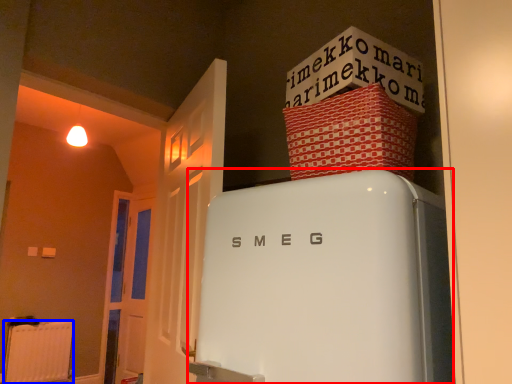
Question: Which point is further to the camera, refrigerator (highlighted by a red box) or radiator (highlighted by a blue box)?

Choices:
 (A) refrigerator
 (B) radiator

Answer: (B)